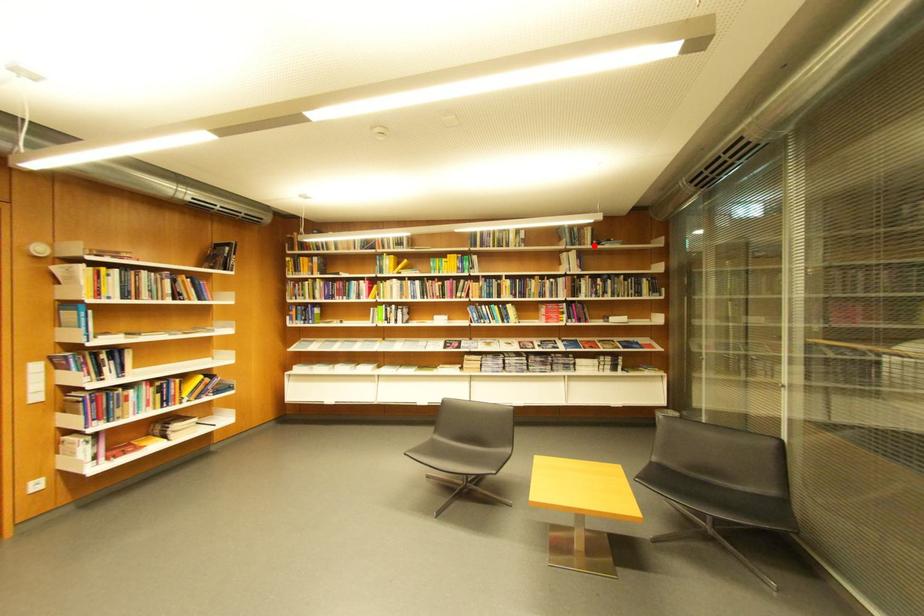
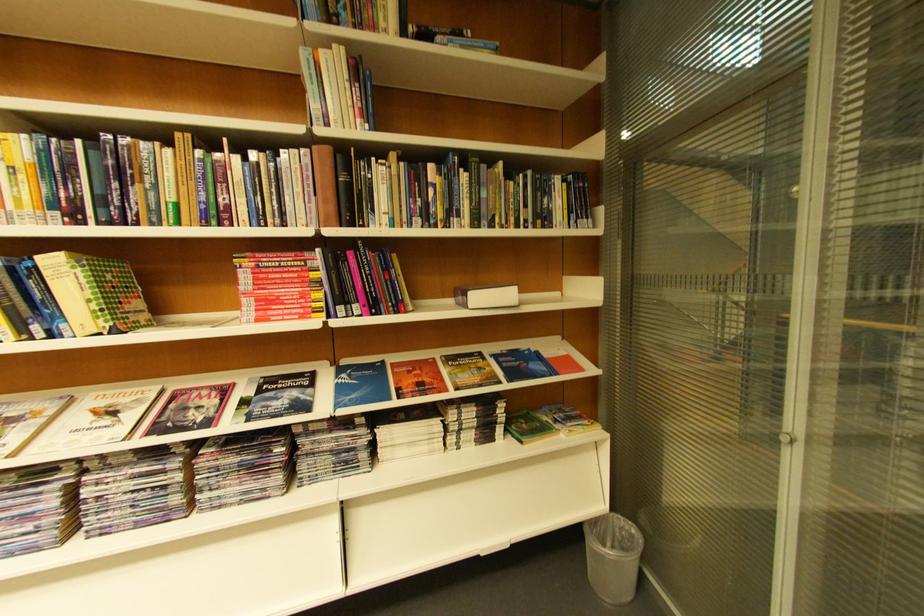
The point at the highlighted location is marked in the first image. Where is the corresponding point in the second image?

(384, 31)